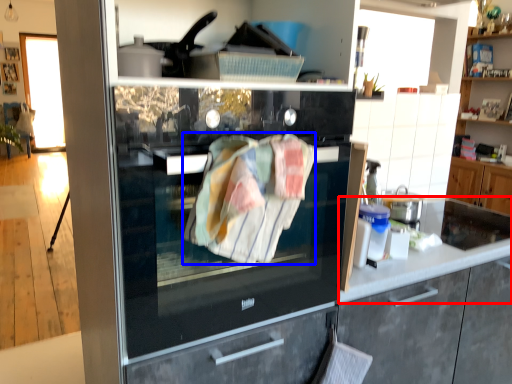
Question: Which object is further to the camera taking this photo, countertop (highlighted by a red box) or blanket (highlighted by a blue box)?

Choices:
 (A) countertop
 (B) blanket

Answer: (A)